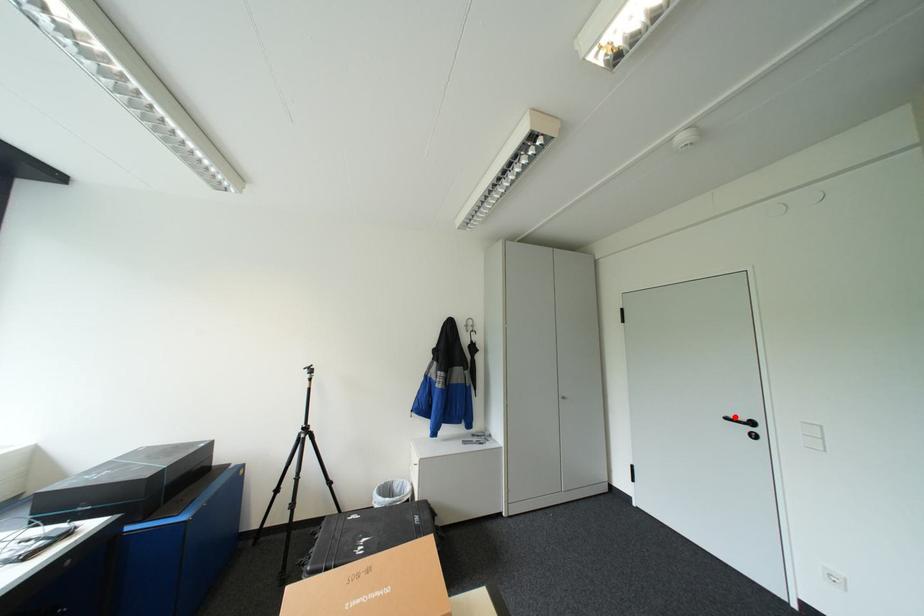
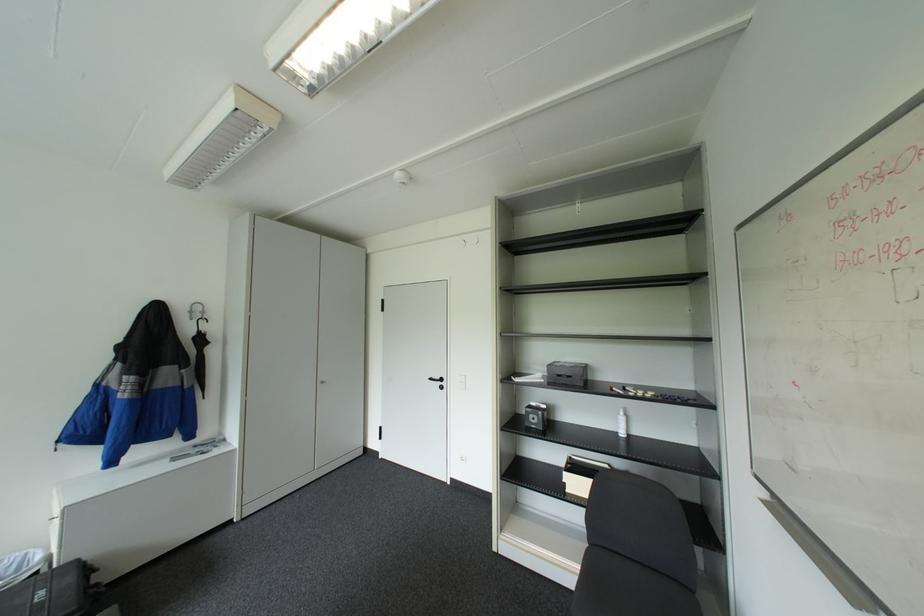
Where in the second image is the point corresponding to the highlighted location from the first image?

(439, 378)